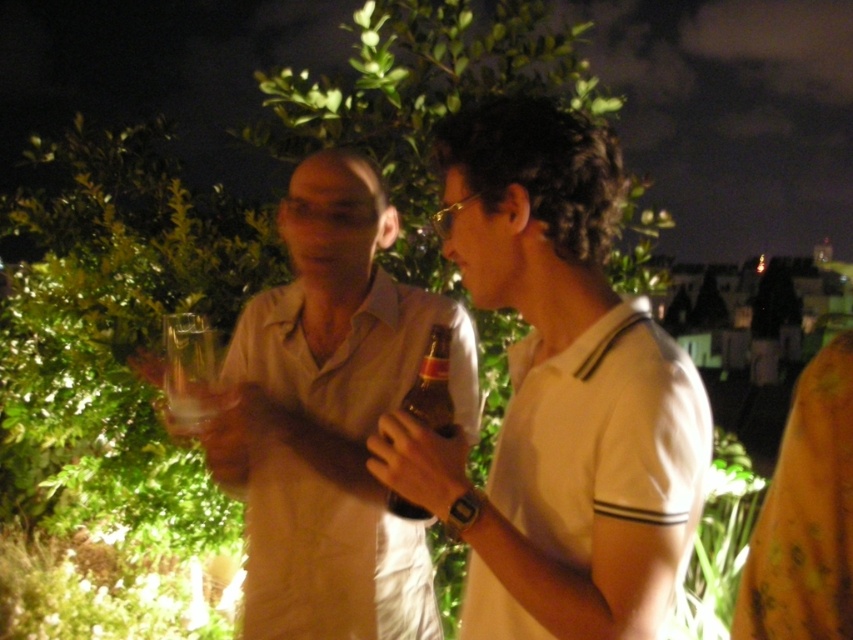
Is matte beige shirt at center positioned before brown glass bottle at center?

That is False.

Does matte beige shirt at center appear on the right side of brown glass bottle at center?

No, matte beige shirt at center is not to the right of brown glass bottle at center.

This screenshot has height=640, width=853. What do you see at coordinates (329, 419) in the screenshot? I see `matte beige shirt at center` at bounding box center [329, 419].

This screenshot has width=853, height=640. Identify the location of matte beige shirt at center. (329, 419).

Which is below, clear glass at center or brown glass bottle at center?

Positioned lower is brown glass bottle at center.

Is clear glass at center taller than brown glass bottle at center?

In fact, clear glass at center may be shorter than brown glass bottle at center.

You are a GUI agent. You are given a task and a screenshot of the screen. Output one action in this format:
    pyautogui.click(x=<x>, y=<y>)
    Task: Click on the clear glass at center
    The width and height of the screenshot is (853, 640).
    Given the screenshot: What is the action you would take?
    pyautogui.click(x=189, y=369)

The height and width of the screenshot is (640, 853). I want to click on white cotton shirt at center, so click(558, 394).

Is white cotton shirt at center wider than matte beige shirt at center?

In fact, white cotton shirt at center might be narrower than matte beige shirt at center.

Is point (605, 170) farther from camera compared to point (419, 605)?

No, it is in front of (419, 605).

Locate an element on the screen. The image size is (853, 640). white cotton shirt at center is located at coordinates (558, 394).